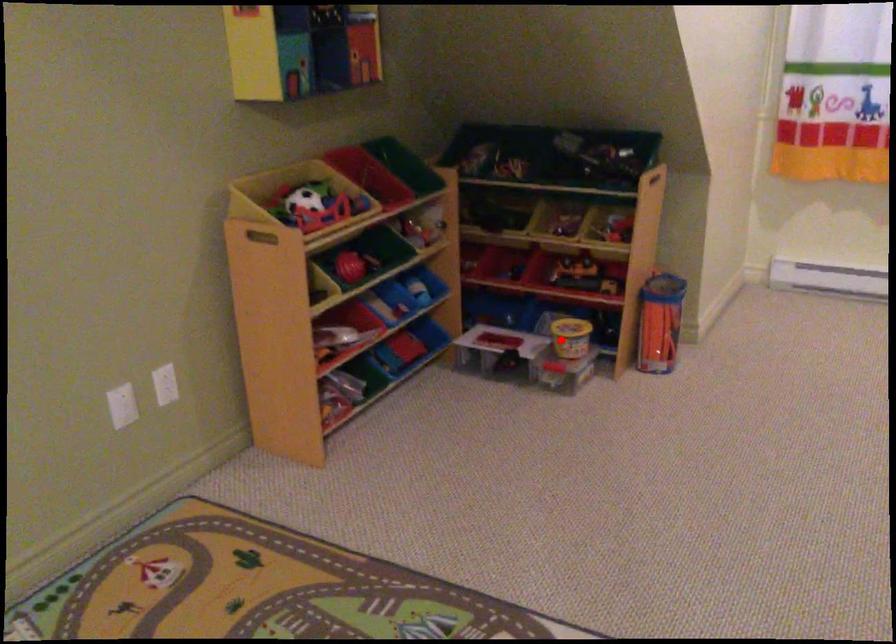
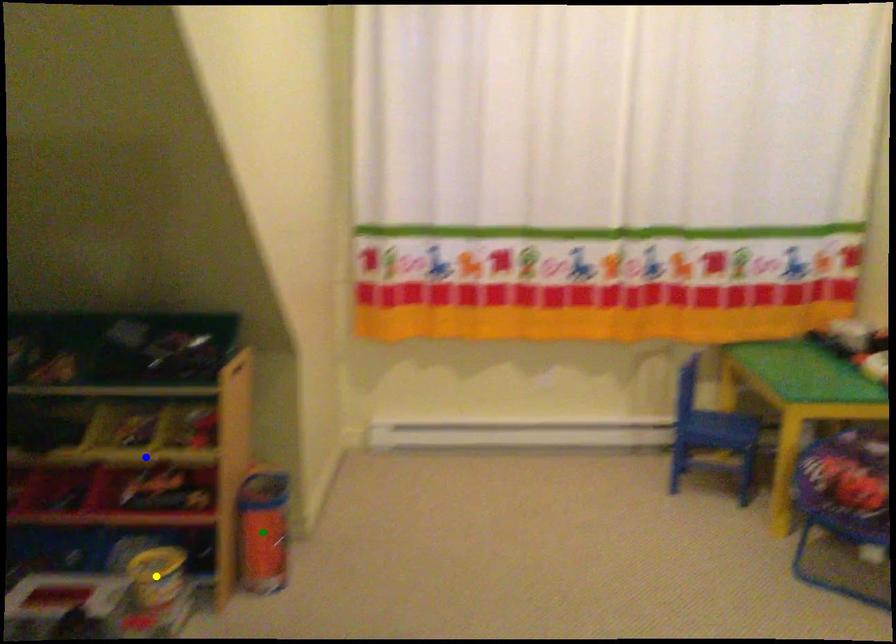
Question: I am providing you with two images of the same scene from different viewpoints. A red point is marked on the first image. You are given multiple points on the second image. In image 2, which mark is for the same physical point as the one in image 1?

Choices:
 (A) blue point
 (B) yellow point
 (C) green point

Answer: (B)